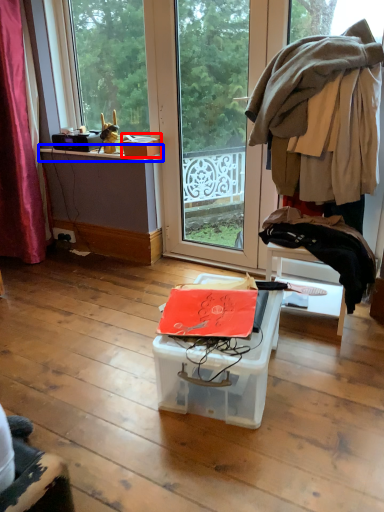
Question: Which of the following is the farthest to the observer, storage box (highlighted by a red box) or window sill (highlighted by a blue box)?

Choices:
 (A) storage box
 (B) window sill

Answer: (B)